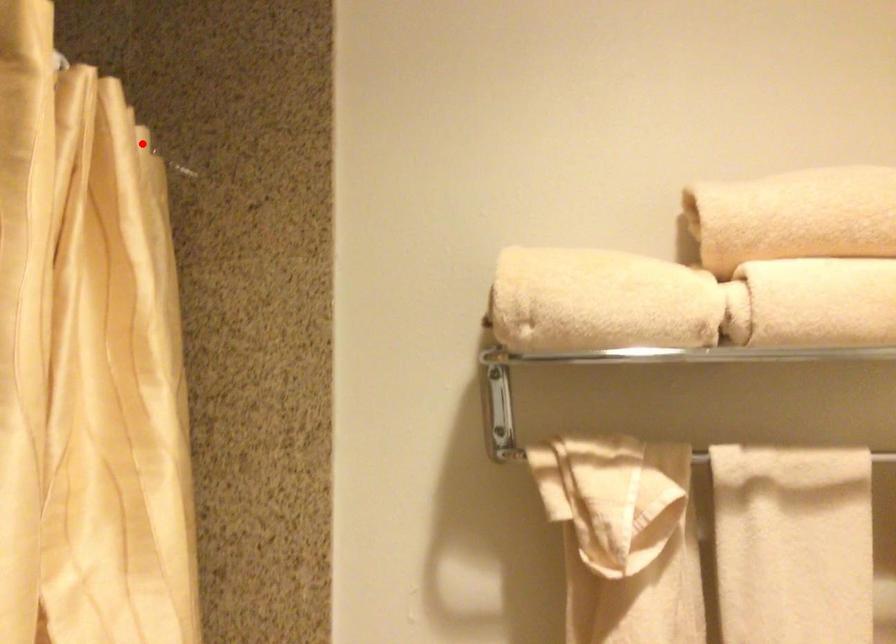
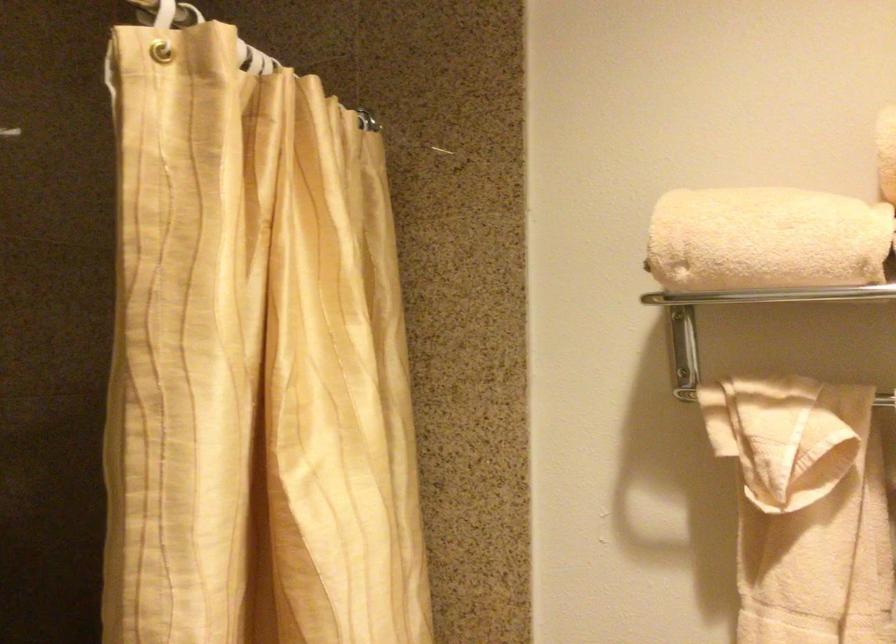
The point at the highlighted location is marked in the first image. Where is the corresponding point in the second image?

(366, 120)